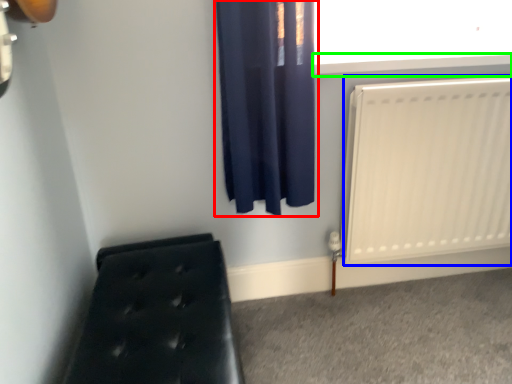
Question: Which object is positioned farthest from curtain (highlighted by a red box)? Select from radiator (highlighted by a blue box) and window sill (highlighted by a green box).

Choices:
 (A) radiator
 (B) window sill

Answer: (A)